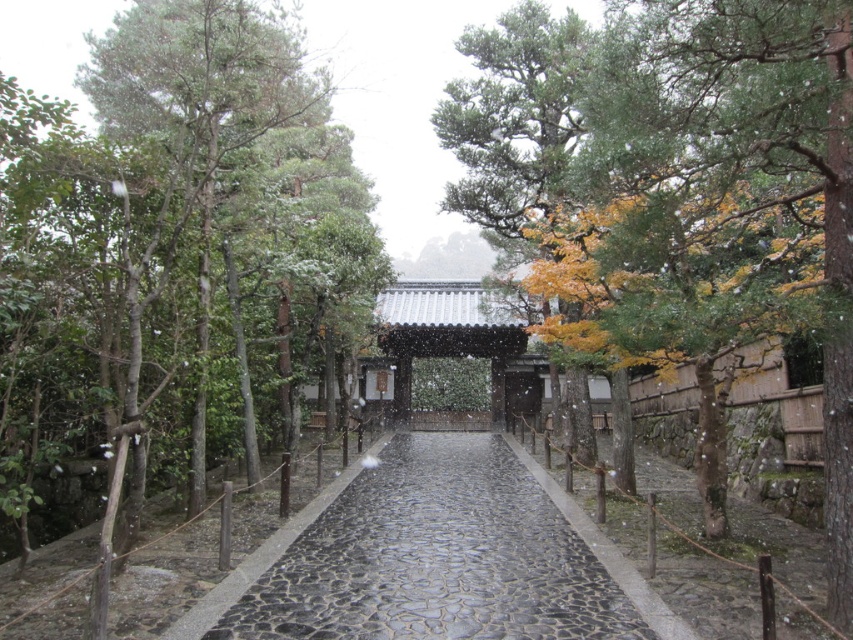
Question: Is green leafy tree at left further to the viewer compared to black cobblestone path at center?

Choices:
 (A) yes
 (B) no

Answer: (B)

Question: Which of the following is the farthest from the observer?

Choices:
 (A) green textured tree at center
 (B) black cobblestone path at center
 (C) green leafy tree at left

Answer: (B)

Question: Among these points, which one is nearest to the camera?

Choices:
 (A) (74, 310)
 (B) (380, 525)
 (C) (581, 76)

Answer: (A)

Question: Where is green leafy tree at left located in relation to green textured tree at center in the image?

Choices:
 (A) above
 (B) below

Answer: (A)

Question: From the image, what is the correct spatial relationship of green textured tree at center in relation to black cobblestone path at center?

Choices:
 (A) above
 (B) below

Answer: (A)

Question: Which point is farther to the camera?

Choices:
 (A) green leafy tree at left
 (B) black cobblestone path at center

Answer: (B)